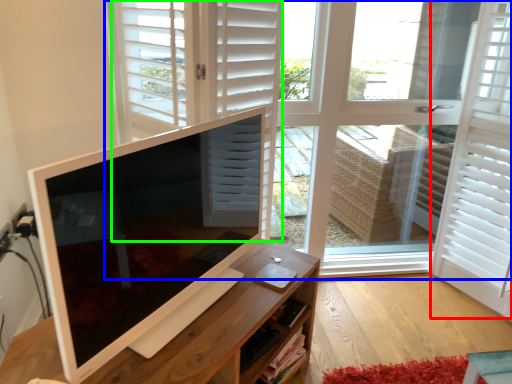
Question: Considering the real-world distances, which object is farthest from shutter (highlighted by a red box)? window (highlighted by a blue box) or door (highlighted by a green box)?

Choices:
 (A) window
 (B) door

Answer: (B)